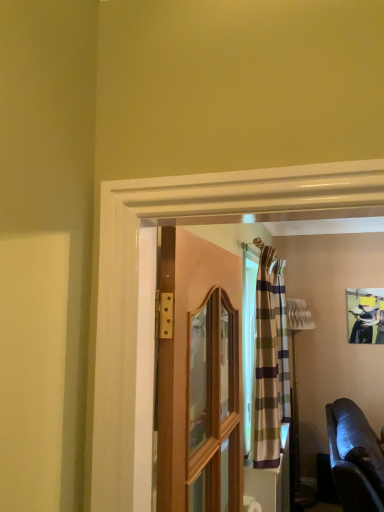
What do you see at coordinates (198, 373) in the screenshot? I see `wooden door at center` at bounding box center [198, 373].

What are the coordinates of `matte black picture frame at upper right` in the screenshot? It's located at (365, 316).

What is the approximate height of leather couch at lower right?

leather couch at lower right is 98.77 centimeters in height.

What do you see at coordinates (354, 458) in the screenshot?
I see `leather couch at lower right` at bounding box center [354, 458].

You are a GUI agent. You are given a task and a screenshot of the screen. Output one action in this format:
    pyautogui.click(x=<x>, y=<y>)
    Task: Click on the wooden door at center
    This screenshot has width=384, height=512.
    Given the screenshot: What is the action you would take?
    pyautogui.click(x=198, y=373)

Is matte black picture frame at upper right taller than leather couch at lower right?

In fact, matte black picture frame at upper right may be shorter than leather couch at lower right.

Considering the points (363, 308) and (371, 472), which point is in front, point (363, 308) or point (371, 472)?

The point (371, 472) is more forward.

Based on the photo, considering the positions of objects matte black picture frame at upper right and leather couch at lower right in the image provided, who is more to the left, matte black picture frame at upper right or leather couch at lower right?

Positioned to the left is leather couch at lower right.

Would you say wooden door at center is to the left or to the right of striped fabric curtain at center in the picture?

wooden door at center is positioned on striped fabric curtain at center's left side.

Considering the sizes of wooden door at center and striped fabric curtain at center in the image, is wooden door at center taller or shorter than striped fabric curtain at center?

Clearly, wooden door at center is shorter compared to striped fabric curtain at center.

Would you say wooden door at center is inside or outside matte black picture frame at upper right?

wooden door at center is not inside matte black picture frame at upper right, it's outside.

Can you confirm if wooden door at center is bigger than matte black picture frame at upper right?

Yes.

Are wooden door at center and matte black picture frame at upper right far apart?

Yes, wooden door at center and matte black picture frame at upper right are located far from each other.

Does striped fabric curtain at center have a greater height compared to leather couch at lower right?

Indeed, striped fabric curtain at center has a greater height compared to leather couch at lower right.

Is striped fabric curtain at center situated inside leather couch at lower right or outside?

striped fabric curtain at center is outside leather couch at lower right.

Is striped fabric curtain at center behind leather couch at lower right?

That is True.

Is striped fabric curtain at center not within wooden door at center?

Yes, striped fabric curtain at center is not within wooden door at center.

Who is smaller, striped fabric curtain at center or wooden door at center?

wooden door at center.

Are striped fabric curtain at center and wooden door at center far apart?

Yes, striped fabric curtain at center is far from wooden door at center.

Consider the image. From a real-world perspective, is striped fabric curtain at center located higher than wooden door at center?

Incorrect, from a real-world perspective, striped fabric curtain at center is lower than wooden door at center.

Considering the sizes of leather couch at lower right and striped fabric curtain at center in the image, is leather couch at lower right wider or thinner than striped fabric curtain at center?

Clearly, leather couch at lower right has more width compared to striped fabric curtain at center.

Is leather couch at lower right beside striped fabric curtain at center?

There is a gap between leather couch at lower right and striped fabric curtain at center.

Identify the location of studio couch on the right of striped fabric curtain at center. (354, 458).

In the scene shown: Considering the positions of objects leather couch at lower right and striped fabric curtain at center in the image provided, who is more to the left, leather couch at lower right or striped fabric curtain at center?

striped fabric curtain at center.

From a real-world perspective, is leather couch at lower right physically above wooden door at center?

Actually, leather couch at lower right is physically below wooden door at center in the real world.

Could you tell me if leather couch at lower right is facing wooden door at center?

No.

Is point (334, 452) positioned behind point (217, 362)?

Yes.

The image size is (384, 512). Find the location of `studio couch lying on the left of matte black picture frame at upper right`. studio couch lying on the left of matte black picture frame at upper right is located at coordinates (354, 458).

I want to click on door above the striped fabric curtain at center (from a real-world perspective), so click(198, 373).

Looking at the image, which one is located closer to leather couch at lower right, striped fabric curtain at center or wooden door at center?

Among the two, striped fabric curtain at center is located nearer to leather couch at lower right.

When comparing their distances from striped fabric curtain at center, does wooden door at center or matte black picture frame at upper right seem further?

matte black picture frame at upper right.

Considering their positions, is striped fabric curtain at center positioned further to matte black picture frame at upper right than leather couch at lower right?

The object further to matte black picture frame at upper right is striped fabric curtain at center.

Based on their spatial positions, is wooden door at center or striped fabric curtain at center closer to leather couch at lower right?

Among the two, striped fabric curtain at center is located nearer to leather couch at lower right.

From the image, which object appears to be farther from wooden door at center, leather couch at lower right or matte black picture frame at upper right?

Based on the image, matte black picture frame at upper right appears to be further to wooden door at center.

Estimate the real-world distances between objects in this image. Which object is further from leather couch at lower right, striped fabric curtain at center or matte black picture frame at upper right?

Based on the image, matte black picture frame at upper right appears to be further to leather couch at lower right.

Which object lies nearer to the anchor point striped fabric curtain at center, matte black picture frame at upper right or leather couch at lower right?

Among the two, leather couch at lower right is located nearer to striped fabric curtain at center.

Estimate the real-world distances between objects in this image. Which object is further from wooden door at center, striped fabric curtain at center or leather couch at lower right?

leather couch at lower right.

Locate an element on the screen. curtain between wooden door at center and matte black picture frame at upper right along the z-axis is located at coordinates (270, 361).

At what (x,y) coordinates should I click in order to perform the action: click on studio couch between wooden door at center and matte black picture frame at upper right from front to back. Please return your answer as a coordinate pair (x, y). This screenshot has width=384, height=512. Looking at the image, I should click on (354, 458).

The width and height of the screenshot is (384, 512). I want to click on studio couch between wooden door at center and striped fabric curtain at center along the z-axis, so click(x=354, y=458).

I want to click on curtain positioned between leather couch at lower right and matte black picture frame at upper right from near to far, so click(270, 361).